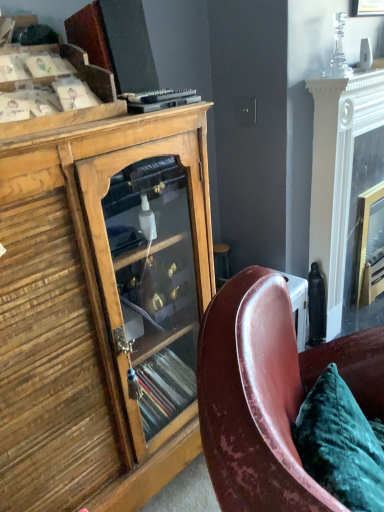
Question: From the image's perspective, is velvet green pillow at lower right on wooden cabinet at left?

Choices:
 (A) no
 (B) yes

Answer: (A)

Question: Is velvet green pillow at lower right outside of wooden cabinet at left?

Choices:
 (A) no
 (B) yes

Answer: (B)

Question: From the image's perspective, is velvet green pillow at lower right beneath wooden cabinet at left?

Choices:
 (A) no
 (B) yes

Answer: (B)

Question: Is velvet green pillow at lower right bigger than wooden cabinet at left?

Choices:
 (A) no
 (B) yes

Answer: (A)

Question: Does velvet green pillow at lower right lie in front of wooden cabinet at left?

Choices:
 (A) yes
 (B) no

Answer: (A)

Question: Is velvet green pillow at lower right to the right of wooden cabinet at left from the viewer's perspective?

Choices:
 (A) yes
 (B) no

Answer: (A)

Question: Considering the relative sizes of white glossy fireplace at right and leather at right in the image provided, is white glossy fireplace at right smaller than leather at right?

Choices:
 (A) no
 (B) yes

Answer: (B)

Question: Is white glossy fireplace at right oriented away from leather at right?

Choices:
 (A) no
 (B) yes

Answer: (A)

Question: Is the position of white glossy fireplace at right less distant than that of leather at right?

Choices:
 (A) yes
 (B) no

Answer: (B)

Question: Is white glossy fireplace at right far away from leather at right?

Choices:
 (A) yes
 (B) no

Answer: (B)

Question: From a real-world perspective, is white glossy fireplace at right positioned over leather at right based on gravity?

Choices:
 (A) yes
 (B) no

Answer: (A)

Question: Is white glossy fireplace at right to the right of leather at right from the viewer's perspective?

Choices:
 (A) no
 (B) yes

Answer: (B)

Question: From a real-world perspective, is white glossy fireplace at right physically below wooden cabinet at upper left?

Choices:
 (A) no
 (B) yes

Answer: (B)